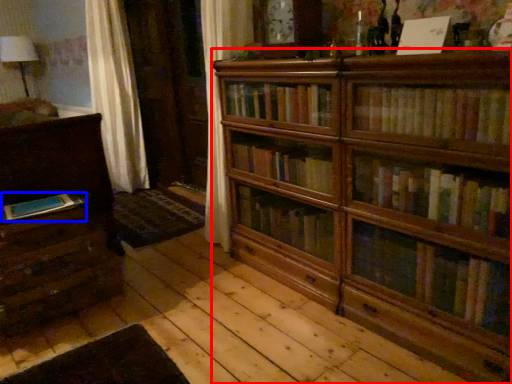
Question: Which object appears farthest to the camera in this image, bookcase (highlighted by a red box) or book (highlighted by a blue box)?

Choices:
 (A) bookcase
 (B) book

Answer: (B)